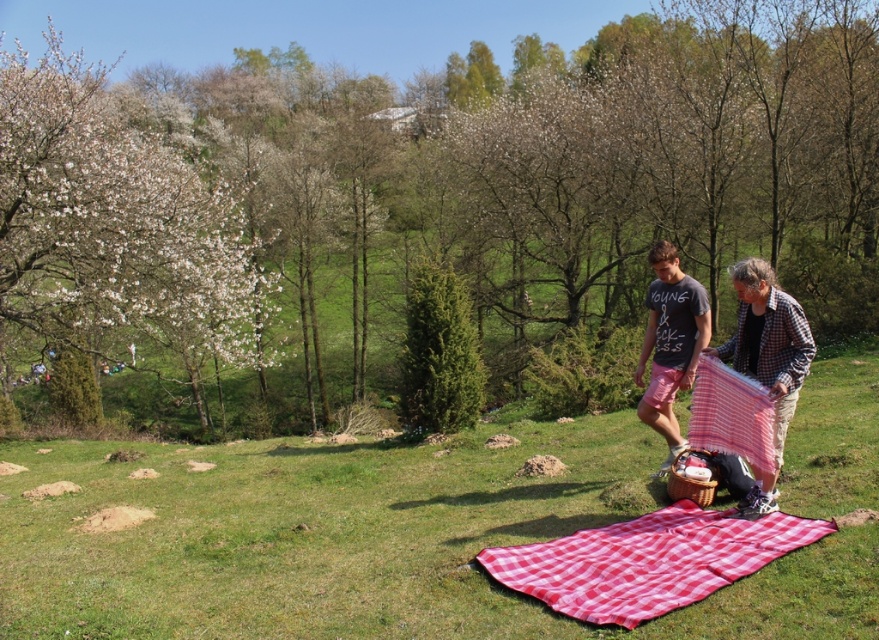
Question: Which object appears farthest from the camera in this image?

Choices:
 (A) white blossoming tree at left
 (B) red checkered picnic blanket at center
 (C) checkered fabric at center

Answer: (A)

Question: Is green leafy tree at center bigger than green grass at center?

Choices:
 (A) yes
 (B) no

Answer: (A)

Question: Does green leafy tree at center lie behind checkered fabric at center?

Choices:
 (A) yes
 (B) no

Answer: (A)

Question: Is green leafy tree at center smaller than red checkered picnic blanket at center?

Choices:
 (A) no
 (B) yes

Answer: (A)

Question: Based on their relative distances, which object is farther from the red checkered cloth at lower right?

Choices:
 (A) green grass at center
 (B) checkered fabric at center
 (C) red checkered picnic blanket at center
 (D) green leafy tree at center

Answer: (D)

Question: Which point is farther to the camera?

Choices:
 (A) red checkered picnic blanket at center
 (B) checkered fabric at center

Answer: (B)